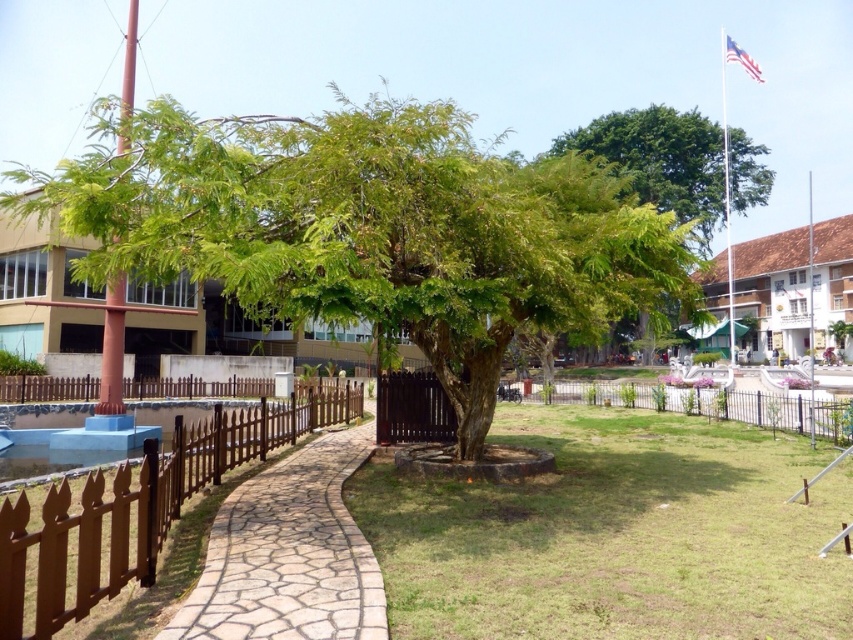
Question: Does brown wooden fence at left lie in front of white painted wood hotel at right?

Choices:
 (A) no
 (B) yes

Answer: (B)

Question: Is brown stone pathway at center further to camera compared to brown wooden fence at left?

Choices:
 (A) no
 (B) yes

Answer: (B)

Question: Which of these objects is positioned closest to the white painted wood hotel at right?

Choices:
 (A) green leafy tree at upper center
 (B) black wrought iron fence at lower right

Answer: (A)

Question: Estimate the real-world distances between objects in this image. Which object is farther from the green leafy tree at left?

Choices:
 (A) black wrought iron fence at lower right
 (B) green grass at center
 (C) green leafy tree at upper center

Answer: (C)

Question: Estimate the real-world distances between objects in this image. Which object is closer to the green leafy tree at center?

Choices:
 (A) polished metal flag pole at upper right
 (B) black wrought iron fence at lower right

Answer: (B)

Question: Is polished metal flag pole at upper right bigger than american flag at upper right?

Choices:
 (A) no
 (B) yes

Answer: (B)